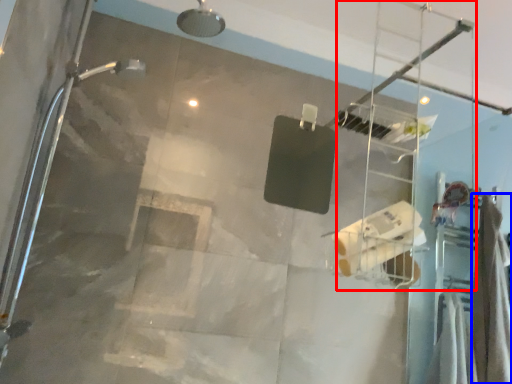
Question: Which point is further to the camera, ladder (highlighted by a red box) or shower curtain (highlighted by a blue box)?

Choices:
 (A) ladder
 (B) shower curtain

Answer: (B)